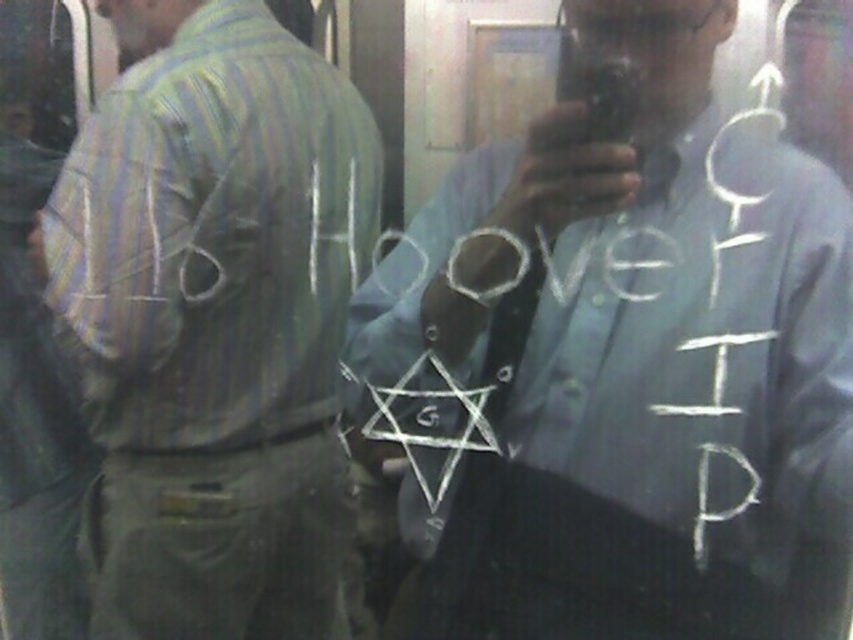
Can you confirm if light blue shirt at center is positioned below striped fabric shirt at left?

Indeed, light blue shirt at center is positioned under striped fabric shirt at left.

Based on the photo, is light blue shirt at center bigger than striped fabric shirt at left?

Correct, light blue shirt at center is larger in size than striped fabric shirt at left.

The height and width of the screenshot is (640, 853). Find the location of `light blue shirt at center`. light blue shirt at center is located at coordinates (633, 360).

I want to click on light blue shirt at center, so click(633, 360).